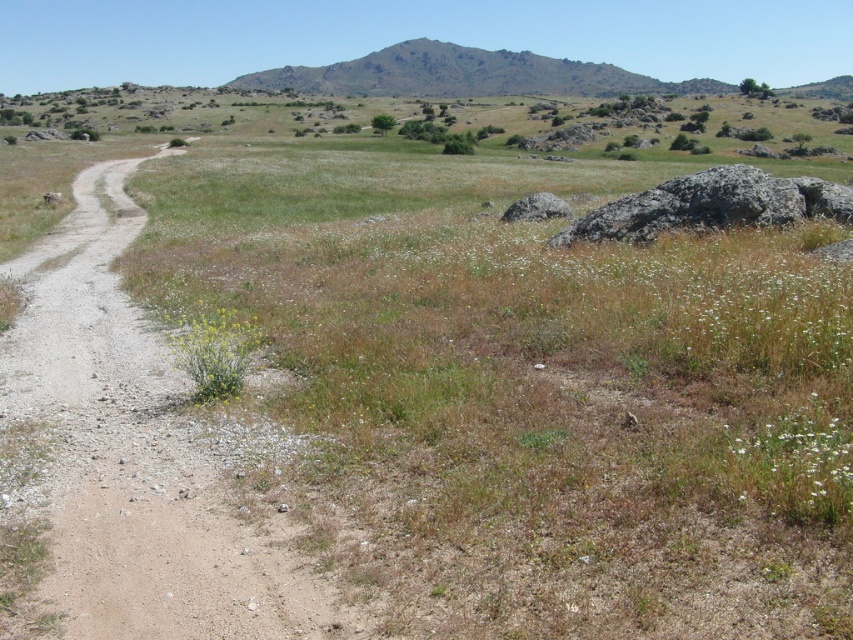
Locate an element on the screen. The image size is (853, 640). brown gravel dirt track at left is located at coordinates (136, 452).

In the scene shown: Is brown gravel dirt track at left above yellow-green leafy plant at lower left?

Indeed, brown gravel dirt track at left is positioned over yellow-green leafy plant at lower left.

This screenshot has height=640, width=853. Identify the location of brown gravel dirt track at left. (136, 452).

Between brown gravel dirt track at left and gray rough rock at right, which one appears on the right side from the viewer's perspective?

gray rough rock at right

What do you see at coordinates (136, 452) in the screenshot? The image size is (853, 640). I see `brown gravel dirt track at left` at bounding box center [136, 452].

Does point (244, 618) lie behind point (612, 211)?

No.

The width and height of the screenshot is (853, 640). What are the coordinates of `brown gravel dirt track at left` in the screenshot? It's located at (136, 452).

This screenshot has height=640, width=853. I want to click on gray rough rock at right, so click(x=711, y=205).

Can you confirm if gray rough rock at right is shorter than yellow-green leafy plant at lower left?

Incorrect, gray rough rock at right's height does not fall short of yellow-green leafy plant at lower left's.

You are a GUI agent. You are given a task and a screenshot of the screen. Output one action in this format:
    pyautogui.click(x=<x>, y=<y>)
    Task: Click on the gray rough rock at right
    Image resolution: width=853 pixels, height=640 pixels.
    Given the screenshot: What is the action you would take?
    point(711,205)